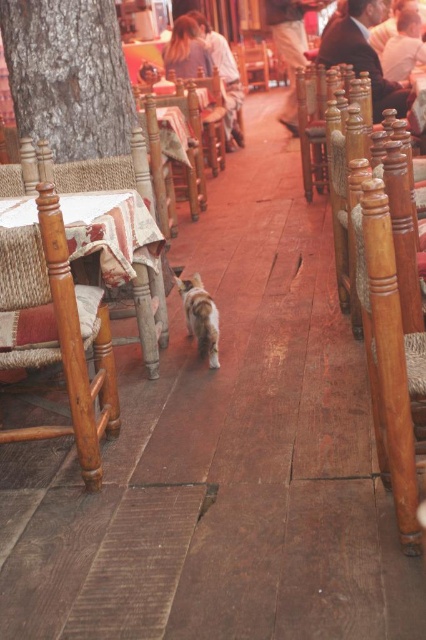
Question: Does fluffy brown cat at center come behind smooth skin face at upper right?

Choices:
 (A) yes
 (B) no

Answer: (B)

Question: Which of the following is the farthest from the observer?

Choices:
 (A) fluffy brown cat at center
 (B) dark brown leather jacket at upper right

Answer: (B)

Question: Does wooden chair at center appear on the left side of light brown hair at upper right?

Choices:
 (A) yes
 (B) no

Answer: (A)

Question: Which of the following is the closest to the observer?

Choices:
 (A) (207, 68)
 (B) (368, 243)
 (C) (189, 205)
 (D) (284, 52)

Answer: (B)

Question: Does light brown fabric pants at center lie behind fluffy brown cat at center?

Choices:
 (A) no
 (B) yes

Answer: (B)

Question: Estimate the real-world distances between objects in this image. Which object is farther from the wooden chair at left?

Choices:
 (A) wooden chair at center
 (B) light brown hair at upper center
 (C) blonde hair at upper center

Answer: (C)